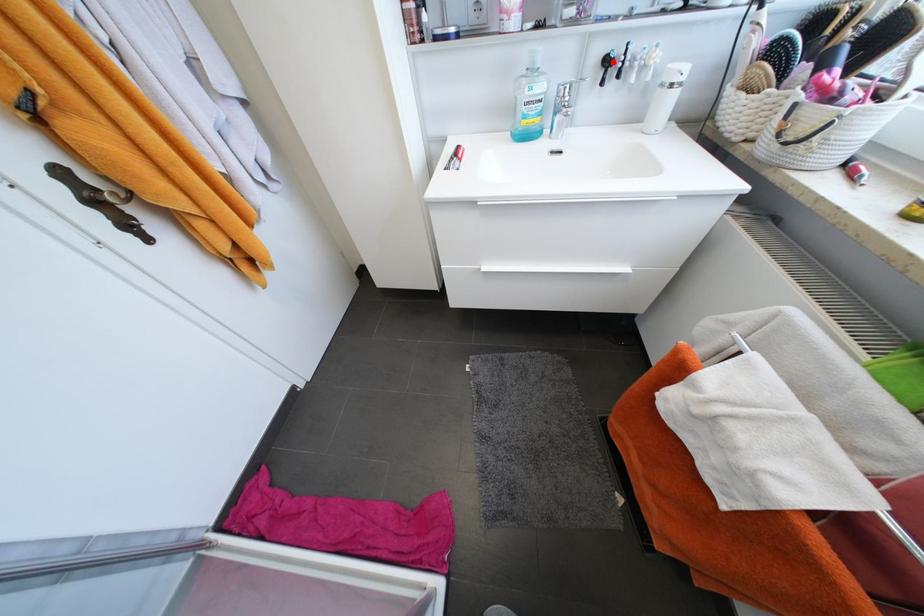
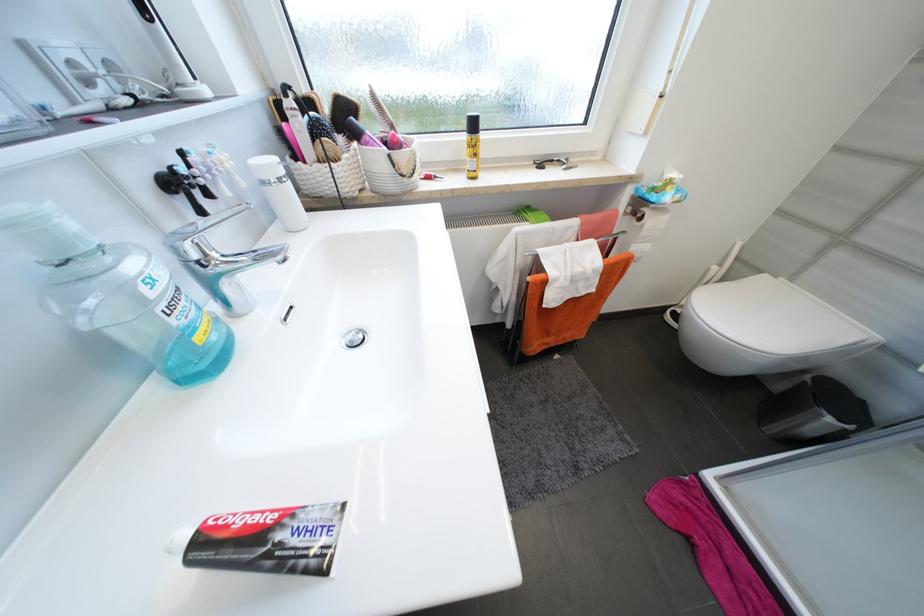
In the second image, find the point that corresponds to the highlighted location in the first image.

(178, 185)